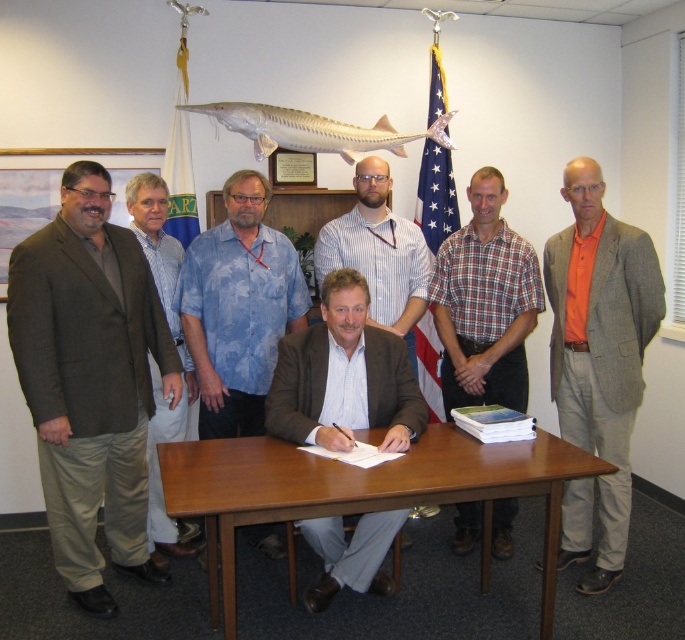
Question: In this image, where is light brown suit at center located relative to blue fabric flag at upper center?

Choices:
 (A) below
 (B) above

Answer: (A)

Question: Among these objects, which one is farthest from the camera?

Choices:
 (A) brown wooden table at center
 (B) shiny silver fish at upper center
 (C) brown textured blazer at left
 (D) brown textured suit at center

Answer: (B)

Question: Can you confirm if brown fabric suit at left is bigger than blue fabric flag at upper center?

Choices:
 (A) no
 (B) yes

Answer: (B)

Question: Which is nearer to the blue fabric flag at upper center?

Choices:
 (A) brown textured blazer at left
 (B) white fabric flag at upper left
 (C) blue tie-dye shirt at center

Answer: (C)

Question: Which point is farther to the camera?

Choices:
 (A) (186, 236)
 (B) (443, 90)
 (C) (327, 234)
 (D) (158, 406)

Answer: (B)

Question: Can you confirm if brown wooden table at center is positioned to the left of white fabric flag at upper left?

Choices:
 (A) no
 (B) yes

Answer: (A)